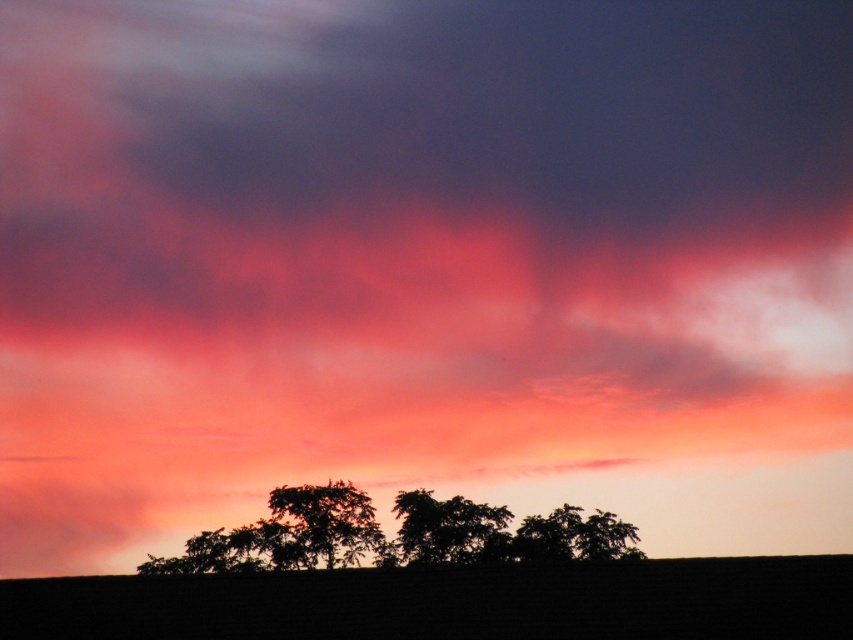
Describe the element at coordinates (397, 534) in the screenshot. I see `silhouette trees at center` at that location.

Between point (434, 504) and point (447, 561), which one is positioned in front?

Point (434, 504)

Image resolution: width=853 pixels, height=640 pixels. I want to click on silhouette trees at center, so 397,534.